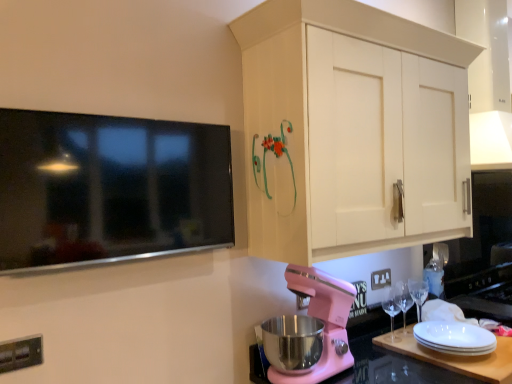
What is the approximate width of pink matte stand mixer at lower center?

pink matte stand mixer at lower center is 42.53 centimeters wide.

Describe the element at coordinates (324, 321) in the screenshot. I see `pink matte stand mixer at lower center` at that location.

The image size is (512, 384). I want to click on clear glass wine glass at lower right, acting as the 1th wine glass starting from the left, so click(x=391, y=313).

This screenshot has height=384, width=512. What do you see at coordinates (380, 279) in the screenshot?
I see `white plastic electric outlet at lower center, the 1th electric outlet when ordered from right to left` at bounding box center [380, 279].

Identify the location of metallic silver electric outlet at lower left, which appears as the first electric outlet when viewed from the left. This screenshot has width=512, height=384. (20, 353).

Locate an element on the screen. This screenshot has width=512, height=384. transparent glass wine glass at lower right, which is counted as the 2th wine glass, starting from the left is located at coordinates (402, 300).

Which of these two, clear glass wine glass at lower right, the second wine glass positioned from the right, or flat screen tv at upper left, is bigger?

flat screen tv at upper left is bigger.

Does point (389, 338) lie behind point (147, 208)?

That is True.

Is clear glass wine glass at lower right, the second wine glass positioned from the right, facing towards flat screen tv at upper left?

No.

From the image's perspective, does clear glass wine glass at lower right, the second wine glass positioned from the right, appear higher than flat screen tv at upper left?

Incorrect, from the image's perspective, clear glass wine glass at lower right, the second wine glass positioned from the right, is lower than flat screen tv at upper left.

Looking at this image, measure the distance between white plastic electric outlet at lower center, the 1th electric outlet when ordered from right to left, and pink matte countertop at lower center.

white plastic electric outlet at lower center, the 1th electric outlet when ordered from right to left, is 15.93 inches from pink matte countertop at lower center.

Is white plastic electric outlet at lower center, the 1th electric outlet when ordered from right to left, positioned behind pink matte countertop at lower center?

Yes, white plastic electric outlet at lower center, the 1th electric outlet when ordered from right to left, is further from the camera.

Which is closer, [378,279] or [398,358]?

The point [398,358] is closer.

The height and width of the screenshot is (384, 512). Identify the location of electric outlet that is the 1st one above the pink matte countertop at lower center (from a real-world perspective). (380, 279).

Is white matte cabinet at upper right not within pink matte countertop at lower center?

Absolutely, white matte cabinet at upper right is external to pink matte countertop at lower center.

Does white matte cabinet at upper right have a greater height compared to pink matte countertop at lower center?

Yes.

Is white matte cabinet at upper right not near pink matte countertop at lower center?

They are positioned close to each other.

At what (x,y) coordinates should I click in order to perform the action: click on cabinetry above the pink matte countertop at lower center (from the image's perspective). Please return your answer as a coordinate pair (x, y). This screenshot has width=512, height=384. Looking at the image, I should click on (333, 121).

From a real-world perspective, is white matte cabinet at upper right physically located above or below clear glass wine glass at lower right, acting as the 1th wine glass starting from the left?

white matte cabinet at upper right is above clear glass wine glass at lower right, acting as the 1th wine glass starting from the left.

Is white matte cabinet at upper right located outside clear glass wine glass at lower right, the second wine glass positioned from the right?

Yes, white matte cabinet at upper right is outside of clear glass wine glass at lower right, the second wine glass positioned from the right.

Based on the photo, which object is further away from the camera, white matte cabinet at upper right or clear glass wine glass at lower right, acting as the 1th wine glass starting from the left?

clear glass wine glass at lower right, acting as the 1th wine glass starting from the left, is behind.

Looking at this image, is transparent glass wine glass at lower right, the 1th wine glass from the right, positioned behind pink matte countertop at lower center?

Yes, transparent glass wine glass at lower right, the 1th wine glass from the right, is further from the viewer.

Is pink matte countertop at lower center located within transparent glass wine glass at lower right, which is counted as the 2th wine glass, starting from the left?

That's incorrect, pink matte countertop at lower center is not inside transparent glass wine glass at lower right, which is counted as the 2th wine glass, starting from the left.

How many degrees apart are the facing directions of transparent glass wine glass at lower right, the 1th wine glass from the right, and pink matte countertop at lower center?

0.00633 degrees.

Is transparent glass wine glass at lower right, the 1th wine glass from the right, at the right side of pink matte countertop at lower center?

Yes, transparent glass wine glass at lower right, the 1th wine glass from the right, is to the right of pink matte countertop at lower center.

In the image, is metallic silver electric outlet at lower left, which appears as the first electric outlet when viewed from the left, on the left side or the right side of clear glass wine glass at lower right, acting as the 1th wine glass starting from the left?

From the image, it's evident that metallic silver electric outlet at lower left, which appears as the first electric outlet when viewed from the left, is to the left of clear glass wine glass at lower right, acting as the 1th wine glass starting from the left.

Looking at this image, would you say metallic silver electric outlet at lower left, the 1th electric outlet positioned from the front, is outside clear glass wine glass at lower right, the second wine glass positioned from the right?

metallic silver electric outlet at lower left, the 1th electric outlet positioned from the front, lies outside clear glass wine glass at lower right, the second wine glass positioned from the right,'s area.

At what (x,y) coordinates should I click in order to perform the action: click on the 2nd electric outlet directly above the clear glass wine glass at lower right, the second wine glass positioned from the right (from a real-world perspective). Please return your answer as a coordinate pair (x, y). Looking at the image, I should click on (20, 353).

Are metallic silver electric outlet at lower left, placed as the second electric outlet when sorted from right to left, and clear glass wine glass at lower right, acting as the 1th wine glass starting from the left, beside each other?

metallic silver electric outlet at lower left, placed as the second electric outlet when sorted from right to left, and clear glass wine glass at lower right, acting as the 1th wine glass starting from the left, are clearly separated.

Considering the sizes of objects pink matte stand mixer at lower center and white matte cabinet at upper right in the image provided, who is taller, pink matte stand mixer at lower center or white matte cabinet at upper right?

With more height is white matte cabinet at upper right.

Could you tell me if pink matte stand mixer at lower center is facing white matte cabinet at upper right?

No, pink matte stand mixer at lower center does not turn towards white matte cabinet at upper right.

Considering the sizes of pink matte stand mixer at lower center and white matte cabinet at upper right in the image, is pink matte stand mixer at lower center wider or thinner than white matte cabinet at upper right?

Considering their sizes, pink matte stand mixer at lower center looks broader than white matte cabinet at upper right.

Relative to white matte cabinet at upper right, is pink matte stand mixer at lower center in front or behind?

Visually, pink matte stand mixer at lower center is located behind white matte cabinet at upper right.

I want to click on the 1st wine glass positioned below the flat screen tv at upper left (from a real-world perspective), so click(x=391, y=313).

Where is `the 1st electric outlet to the left when counting from the pink matte countertop at lower center`? The height and width of the screenshot is (384, 512). the 1st electric outlet to the left when counting from the pink matte countertop at lower center is located at coordinates (x=380, y=279).

When comparing their distances from white matte cabinet at upper right, does pink matte stand mixer at lower center or metallic silver electric outlet at lower left, the 2th electric outlet positioned from the back, seem further?

metallic silver electric outlet at lower left, the 2th electric outlet positioned from the back, lies further to white matte cabinet at upper right than the other object.

Considering their positions, is white plastic electric outlet at lower center, which is the second electric outlet in front-to-back order, positioned further to white matte cabinet at upper right than pink matte stand mixer at lower center?

white plastic electric outlet at lower center, which is the second electric outlet in front-to-back order, lies further to white matte cabinet at upper right than the other object.

Considering their positions, is white matte cabinet at upper right positioned closer to transparent glass wine glass at lower right, which is counted as the 2th wine glass, starting from the left, than clear glass wine glass at lower right, acting as the 1th wine glass starting from the left?

clear glass wine glass at lower right, acting as the 1th wine glass starting from the left, is closer to transparent glass wine glass at lower right, which is counted as the 2th wine glass, starting from the left.

From the picture: Based on their spatial positions, is transparent glass wine glass at lower right, which is counted as the 2th wine glass, starting from the left, or clear glass wine glass at lower right, acting as the 1th wine glass starting from the left, closer to white plastic electric outlet at lower center, acting as the second electric outlet starting from the left?

transparent glass wine glass at lower right, which is counted as the 2th wine glass, starting from the left, is closer to white plastic electric outlet at lower center, acting as the second electric outlet starting from the left.

When comparing their distances from pink matte stand mixer at lower center, does metallic silver electric outlet at lower left, the 1th electric outlet positioned from the front, or clear glass wine glass at lower right, the second wine glass positioned from the right, seem further?

metallic silver electric outlet at lower left, the 1th electric outlet positioned from the front, is further to pink matte stand mixer at lower center.

Estimate the real-world distances between objects in this image. Which object is closer to flat screen tv at upper left, pink matte stand mixer at lower center or transparent glass wine glass at lower right, the 1th wine glass from the right?

pink matte stand mixer at lower center lies closer to flat screen tv at upper left than the other object.

Based on the photo, based on their spatial positions, is clear glass wine glass at lower right, acting as the 1th wine glass starting from the left, or white plastic electric outlet at lower center, the 1th electric outlet when ordered from right to left, further from transparent glass wine glass at lower right, the 1th wine glass from the right?

white plastic electric outlet at lower center, the 1th electric outlet when ordered from right to left, is positioned further to the anchor transparent glass wine glass at lower right, the 1th wine glass from the right.

From the image, which object appears to be farther from white matte cabinet at upper right, flat screen tv at upper left or clear glass wine glass at lower right, acting as the 1th wine glass starting from the left?

clear glass wine glass at lower right, acting as the 1th wine glass starting from the left, is positioned further to the anchor white matte cabinet at upper right.

At what (x,y) coordinates should I click in order to perform the action: click on wine glass between metallic silver electric outlet at lower left, the 1th electric outlet positioned from the front, and transparent glass wine glass at lower right, which is counted as the 2th wine glass, starting from the left, from left to right. Please return your answer as a coordinate pair (x, y). The height and width of the screenshot is (384, 512). Looking at the image, I should click on (391, 313).

At what (x,y) coordinates should I click in order to perform the action: click on television located between metallic silver electric outlet at lower left, placed as the second electric outlet when sorted from right to left, and pink matte stand mixer at lower center in the left-right direction. Please return your answer as a coordinate pair (x, y). The height and width of the screenshot is (384, 512). Looking at the image, I should click on (109, 189).

The height and width of the screenshot is (384, 512). Identify the location of mixer between metallic silver electric outlet at lower left, placed as the second electric outlet when sorted from right to left, and pink matte countertop at lower center from left to right. (324, 321).

Identify the location of mixer between white matte cabinet at upper right and clear glass wine glass at lower right, the second wine glass positioned from the right, in the up-down direction. (324, 321).